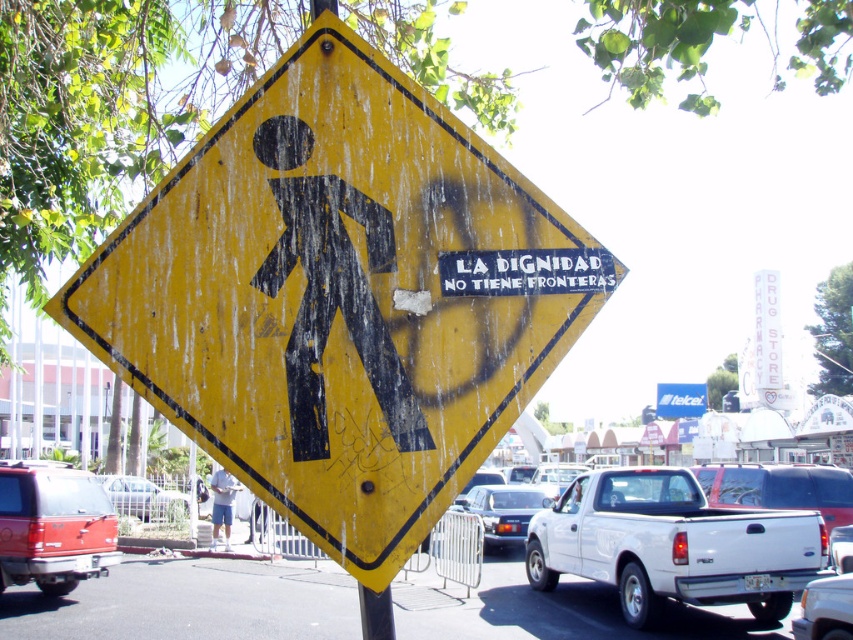
Question: Does yellow matte pedestrian crossing sign at center appear under metallic blue sedan at center?

Choices:
 (A) no
 (B) yes

Answer: (A)

Question: Estimate the real-world distances between objects in this image. Which object is farther from the matte red suv at lower left?

Choices:
 (A) metallic blue sedan at center
 (B) light blue shorts at lower center
 (C) yellow faded pedestrian crossing sign at upper center
 (D) blue plastic sign at center

Answer: (D)

Question: Does matte red suv at lower left appear over silver metallic sedan at lower left?

Choices:
 (A) yes
 (B) no

Answer: (A)

Question: Is white matte pickup truck at lower right above yellow faded pedestrian crossing sign at upper center?

Choices:
 (A) no
 (B) yes

Answer: (A)

Question: Which of the following is the closest to the observer?

Choices:
 (A) (149, 483)
 (B) (440, 276)

Answer: (B)

Question: Which object is the closest to the yellow matte pedestrian crossing sign at center?

Choices:
 (A) silver metallic sedan at lower left
 (B) metallic silver suv at lower right

Answer: (B)